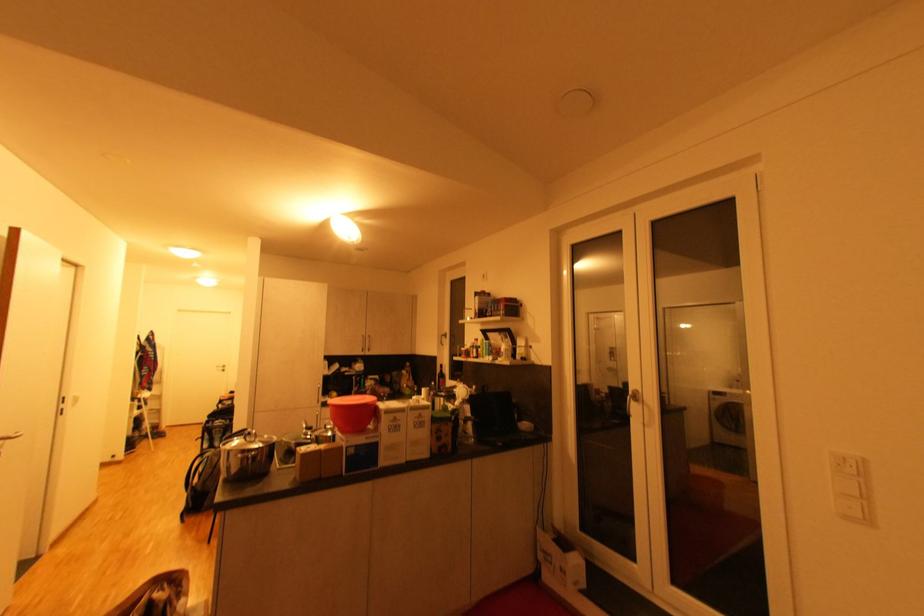
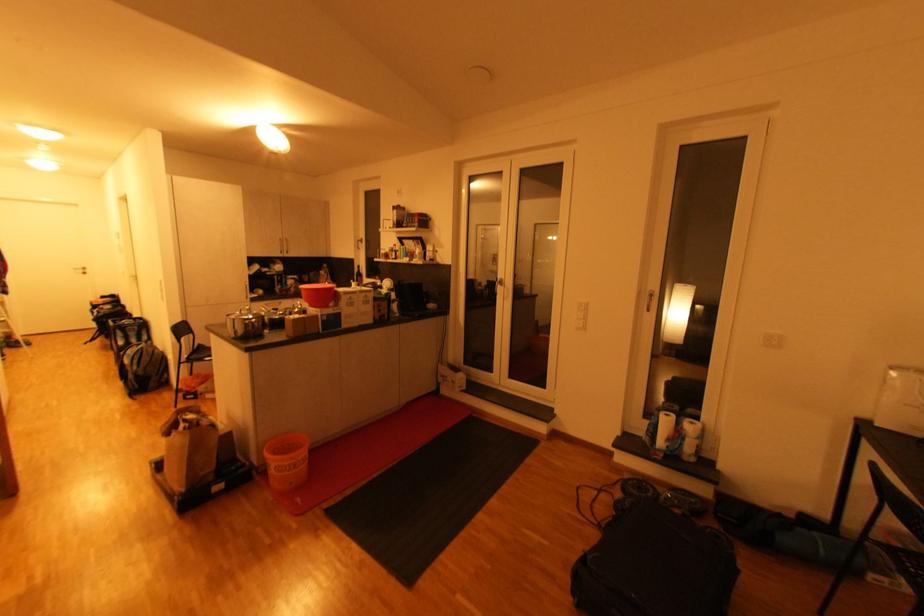
First-person continuous shooting, in which direction is the camera rotating?

The camera's rotation is toward right-down.